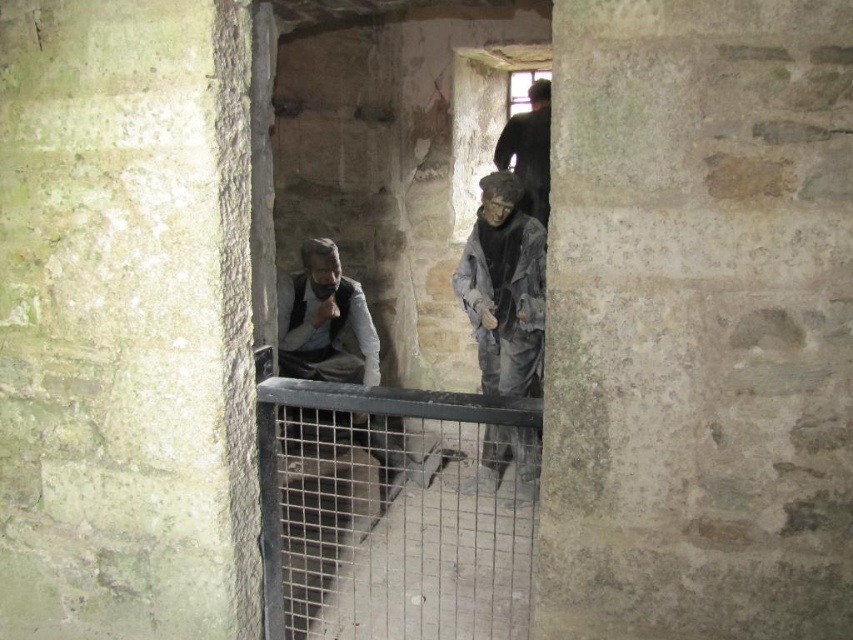
Question: Is metal mesh cage at center thinner than dark gray fabric at upper center?

Choices:
 (A) no
 (B) yes

Answer: (A)

Question: Which of the following is the farthest from the observer?

Choices:
 (A) (146, 141)
 (B) (773, 497)
 (C) (527, 208)

Answer: (C)

Question: Considering the real-world distances, which object is farthest from the dark gray fabric at upper center?

Choices:
 (A) stone textured wall at right
 (B) metal mesh cage at center
 (C) gray fabric figure at center
 (D) green stone pillar at left

Answer: (A)

Question: Among these points, which one is farthest from the camera?

Choices:
 (A) (509, 536)
 (B) (541, 305)

Answer: (B)

Question: Can you confirm if metal mesh cage at center is positioned below dark gray fabric at upper center?

Choices:
 (A) yes
 (B) no

Answer: (A)

Question: Is metal mesh cage at center to the left of gray fabric figure at center from the viewer's perspective?

Choices:
 (A) no
 (B) yes

Answer: (B)